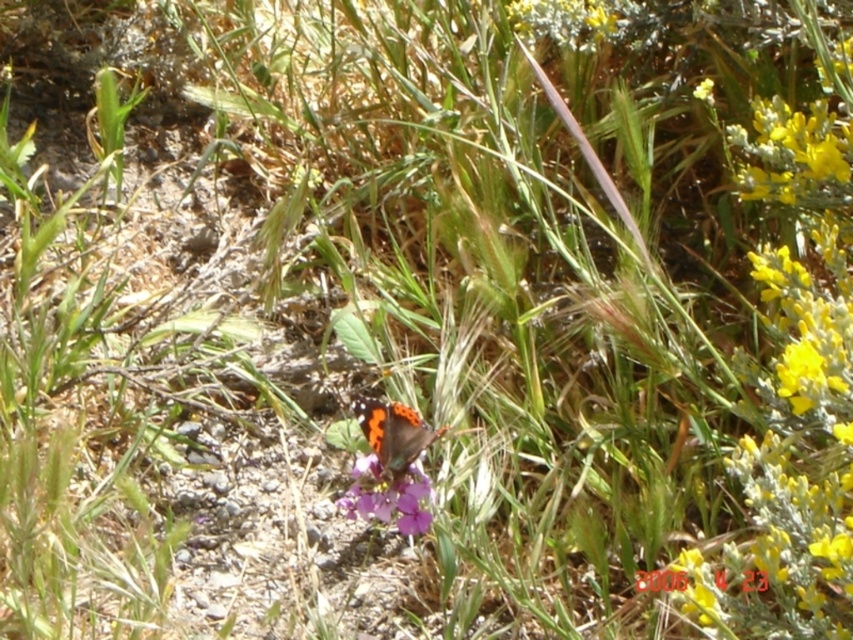
Is point (364, 509) farther from camera compared to point (426, 442)?

Yes.

Is point (407, 493) positioned after point (393, 442)?

Yes, it is behind point (393, 442).

Where is `purple matte flower at center`? purple matte flower at center is located at coordinates [387, 497].

Is yellow matte flower at upper right above orange-patterned wings at center?

Yes, yellow matte flower at upper right is above orange-patterned wings at center.

Is yellow matte flower at upper right smaller than orange-patterned wings at center?

No, yellow matte flower at upper right is not smaller than orange-patterned wings at center.

The height and width of the screenshot is (640, 853). What are the coordinates of `yellow matte flower at upper right` in the screenshot? It's located at (795, 372).

Who is shorter, yellow matte flower at upper right or purple matte flower at center?

purple matte flower at center is shorter.

Can you confirm if yellow matte flower at upper right is taller than purple matte flower at center?

Correct, yellow matte flower at upper right is much taller as purple matte flower at center.

Does point (817, 392) lie behind point (412, 528)?

That is False.

I want to click on yellow matte flower at upper right, so click(795, 372).